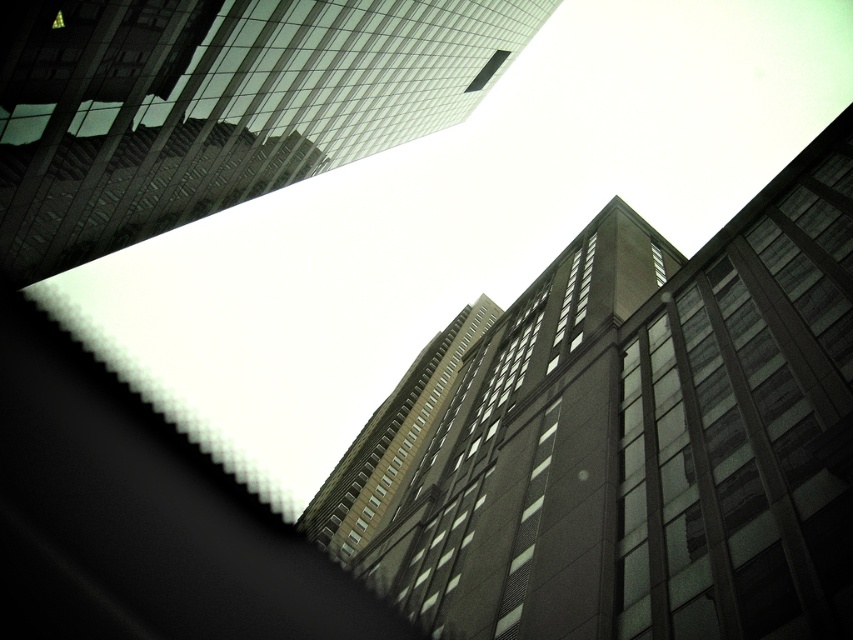
Question: Does dark gray concrete building at center appear over brown glass building at center?

Choices:
 (A) no
 (B) yes

Answer: (B)

Question: Does dark gray concrete building at center appear over brown glass building at center?

Choices:
 (A) no
 (B) yes

Answer: (B)

Question: Which point appears closest to the camera in this image?

Choices:
 (A) (584, 492)
 (B) (38, 259)

Answer: (A)

Question: Among these points, which one is nearest to the camera?

Choices:
 (A) (790, 417)
 (B) (194, 36)

Answer: (A)

Question: Can you confirm if glassy reflective skyscraper at upper center is positioned to the left of brown glass building at center?

Choices:
 (A) no
 (B) yes

Answer: (A)

Question: Which of the following is the farthest from the observer?

Choices:
 (A) (41, 273)
 (B) (845, 304)

Answer: (A)